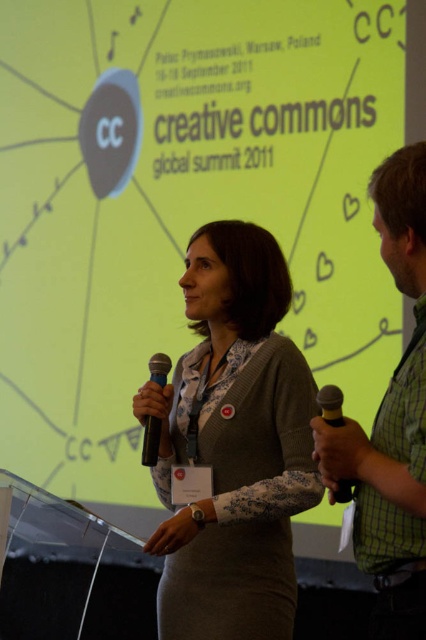
Question: Where is matte gray dress at center located in relation to black matte microphone at center in the image?

Choices:
 (A) left
 (B) right

Answer: (B)

Question: In this image, where is green checkered shirt at right located relative to black matte microphone at center?

Choices:
 (A) right
 (B) left

Answer: (A)

Question: Considering the real-world distances, which object is closest to the green checkered shirt at right?

Choices:
 (A) black matte microphone at center
 (B) metallic gold microphone at lower right
 (C) matte gray dress at center

Answer: (B)

Question: Can you confirm if matte gray dress at center is positioned to the right of metallic gold microphone at lower right?

Choices:
 (A) no
 (B) yes

Answer: (A)

Question: Which of these objects is positioned closest to the black matte microphone at center?

Choices:
 (A) metallic gold microphone at lower right
 (B) green checkered shirt at right

Answer: (A)

Question: Which of the following is the closest to the observer?

Choices:
 (A) pos(152,464)
 (B) pos(339,392)
 (C) pos(391,211)
 (D) pos(247,275)

Answer: (C)